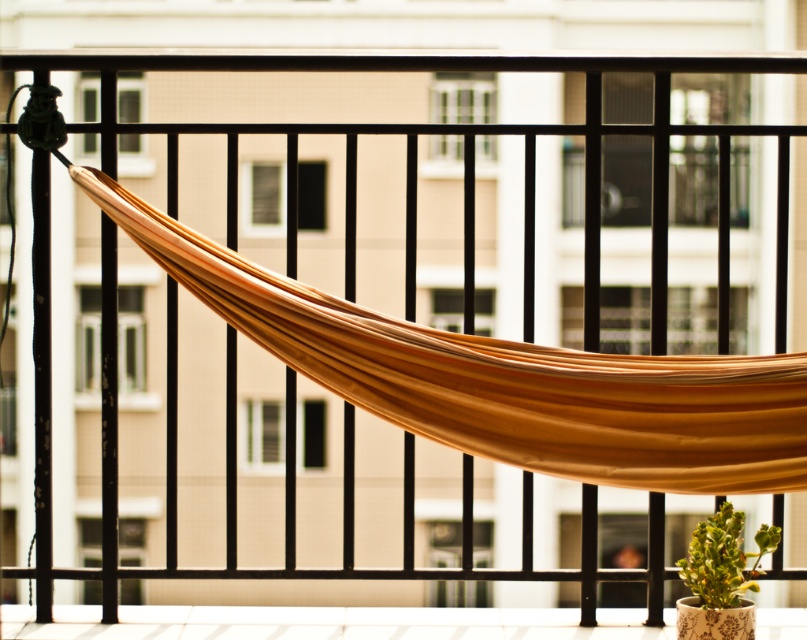
Question: Which of the following is the farthest from the observer?

Choices:
 (A) green leafy plant at lower right
 (B) brown fabric hammock at center

Answer: (A)

Question: Does brown fabric hammock at center have a lesser width compared to green leafy plant at lower right?

Choices:
 (A) yes
 (B) no

Answer: (B)

Question: Is brown fabric hammock at center positioned behind green leafy plant at lower right?

Choices:
 (A) yes
 (B) no

Answer: (B)

Question: Which point appears closest to the camera in this image?

Choices:
 (A) (555, 436)
 (B) (732, 605)

Answer: (A)

Question: Is brown fabric hammock at center thinner than green leafy plant at lower right?

Choices:
 (A) no
 (B) yes

Answer: (A)